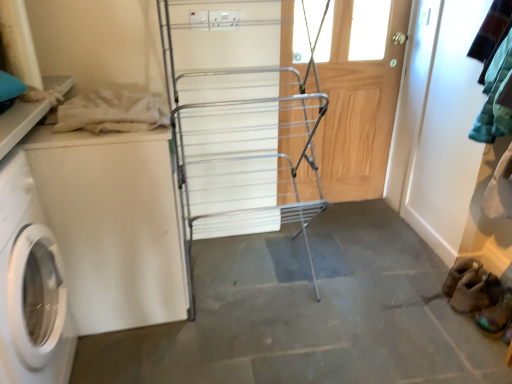
Locate an element on the screen. vacant space in silver metallic drying rack at center (from a real-world perspective) is located at coordinates (249, 279).